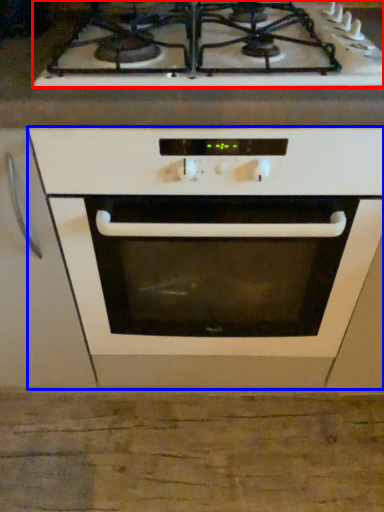
Question: Which point is further to the camera, gas stove (highlighted by a red box) or oven (highlighted by a blue box)?

Choices:
 (A) gas stove
 (B) oven

Answer: (A)